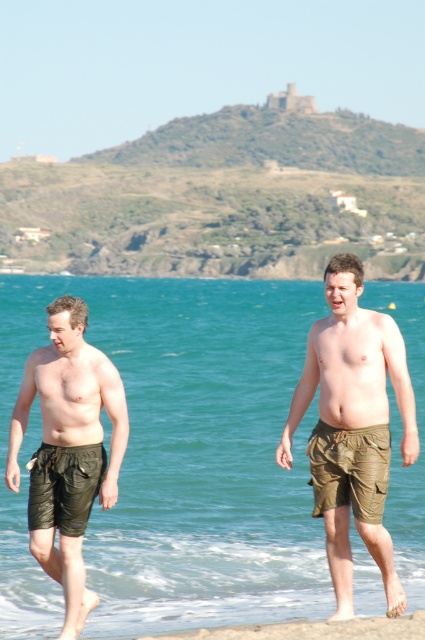
You are a photographer trying to capture the matte khaki shorts at center in the image. Based on their position, which direction should you move to get them centered in your frame?

The matte khaki shorts at center are located at coordinates point (353, 428). To center them in the frame, you should move the camera slightly to the left and down since the current position is to the right and above the center point.

You are a photographer trying to capture both the matte olive green swim shorts at left and the green leather shorts at lower left in a single frame. Which pair of shorts will appear bigger in the photo?

The matte olive green swim shorts at left will appear bigger in the photo because they are larger in size than the green leather shorts at lower left.

You are a photographer trying to capture both the green fabric shorts at center and the matte khaki shorts at center in a single frame. Based on their widths, which pair of shorts should be closer to the camera to ensure both are fully visible in the photo?

The green fabric shorts at center might be wider than matte khaki shorts at center, so to ensure both are fully visible in the photo, the wider green fabric shorts at center should be closer to the camera.